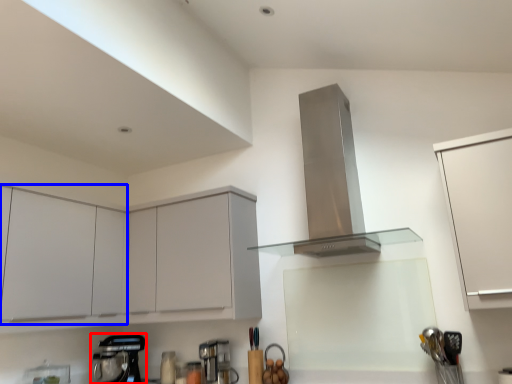
Question: Among these objects, which one is nearest to the camera, kitchen appliance (highlighted by a red box) or cabinetry (highlighted by a blue box)?

Choices:
 (A) kitchen appliance
 (B) cabinetry

Answer: (B)